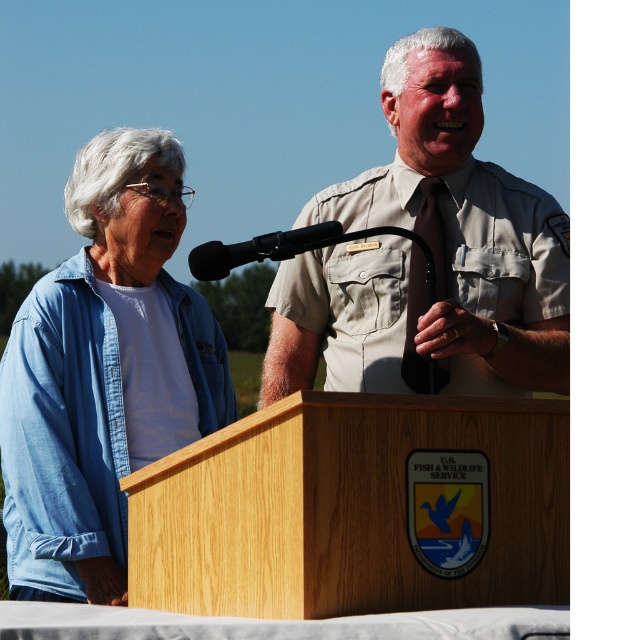
Is khaki uniform at center to the left of denim shirt at left from the viewer's perspective?

In fact, khaki uniform at center is to the right of denim shirt at left.

Between khaki uniform at center and denim shirt at left, which one appears on the left side from the viewer's perspective?

Positioned to the left is denim shirt at left.

Is point (500, 330) farther from camera compared to point (99, 353)?

No, it is not.

The width and height of the screenshot is (620, 640). Find the location of `khaki uniform at center`. khaki uniform at center is located at coordinates (435, 253).

Between khaki uniform at center and black matte microphone at center, which one appears on the left side from the viewer's perspective?

From the viewer's perspective, black matte microphone at center appears more on the left side.

Which is above, khaki uniform at center or black matte microphone at center?

black matte microphone at center is above.

What are the coordinates of `khaki uniform at center` in the screenshot? It's located at (435, 253).

Looking at this image, is wooden podium at center shorter than khaki uniform at center?

Indeed, wooden podium at center has a lesser height compared to khaki uniform at center.

Measure the distance between wooden podium at center and camera.

wooden podium at center and camera are 18.62 feet apart.

Find the location of a particular element. wooden podium at center is located at coordinates (355, 508).